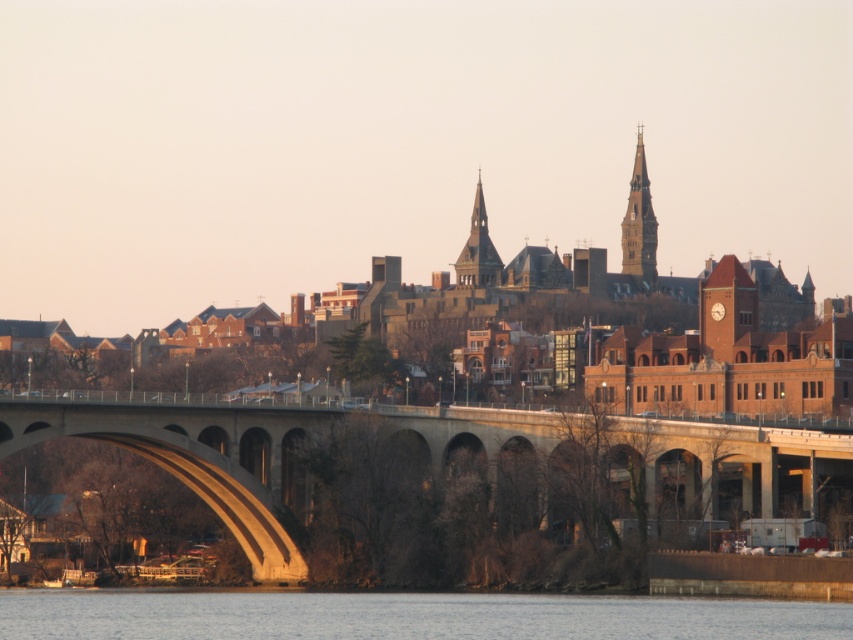
Question: Is concrete bridge at center closer to the viewer compared to smooth gray spire at center?

Choices:
 (A) no
 (B) yes

Answer: (B)

Question: Does smooth gray stone spire at upper right appear on the left side of smooth gray spire at center?

Choices:
 (A) no
 (B) yes

Answer: (A)

Question: Based on their relative distances, which object is nearer to the concrete bridge at center?

Choices:
 (A) smooth water at lower center
 (B) smooth gray stone spire at upper right

Answer: (A)

Question: Which is farther from the concrete bridge at center?

Choices:
 (A) smooth gray stone spire at upper right
 (B) smooth gray spire at center

Answer: (A)

Question: Is smooth gray stone spire at upper right behind smooth gray spire at center?

Choices:
 (A) no
 (B) yes

Answer: (B)

Question: Which of the following is the farthest from the observer?

Choices:
 (A) (480, 196)
 (B) (389, 605)
 (C) (798, 452)

Answer: (A)